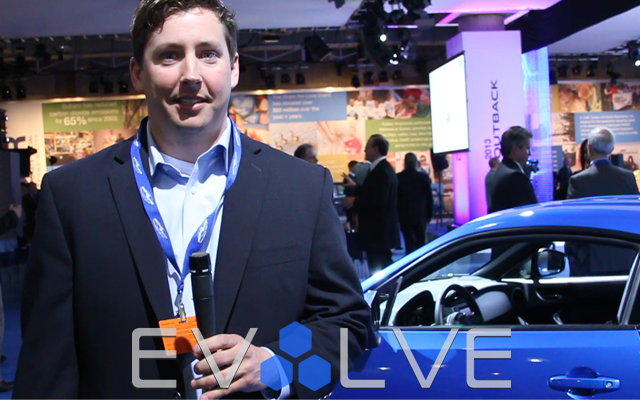
This screenshot has height=400, width=640. Find the location of `posterboard`. posterboard is located at coordinates (326, 122).